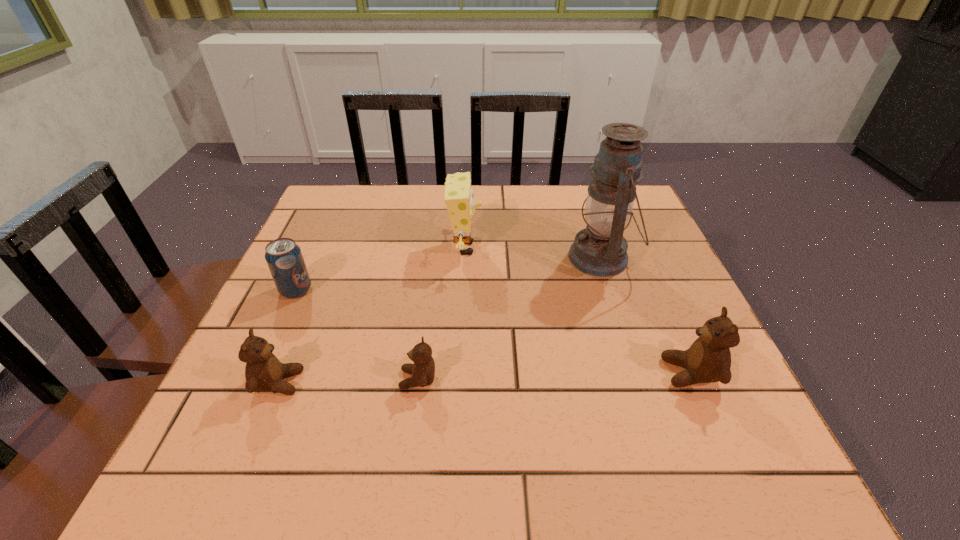
The image size is (960, 540). Identify the location of free location located at the face of the third object from left to right. (254, 379).

Identify the location of vacant space located 0.240m at the face of the third object from left to right. (271, 379).

Where is `free region located 0.320m at the face of the third object from left to right`? free region located 0.320m at the face of the third object from left to right is located at coordinates (227, 379).

Find the location of `free space located 0.170m at the face of the fourth shortest object`. free space located 0.170m at the face of the fourth shortest object is located at coordinates (574, 373).

What are the coordinates of `vacant space positioned 0.390m at the face of the fourth shortest object` in the screenshot? It's located at (456, 373).

Locate an element on the screen. The width and height of the screenshot is (960, 540). free space located 0.330m at the face of the fourth shortest object is located at coordinates (488, 373).

Where is `vacant position located on the left of the oil lamp`? The height and width of the screenshot is (540, 960). vacant position located on the left of the oil lamp is located at coordinates (503, 258).

Find the location of a particular element. Image resolution: width=960 pixels, height=540 pixels. free space located 0.220m on the face of the fifth shortest object is located at coordinates (569, 248).

I want to click on free space located 0.360m on the right of the pop soda, so click(x=471, y=291).

Identify the location of object present at the far edge. This screenshot has width=960, height=540. (458, 196).